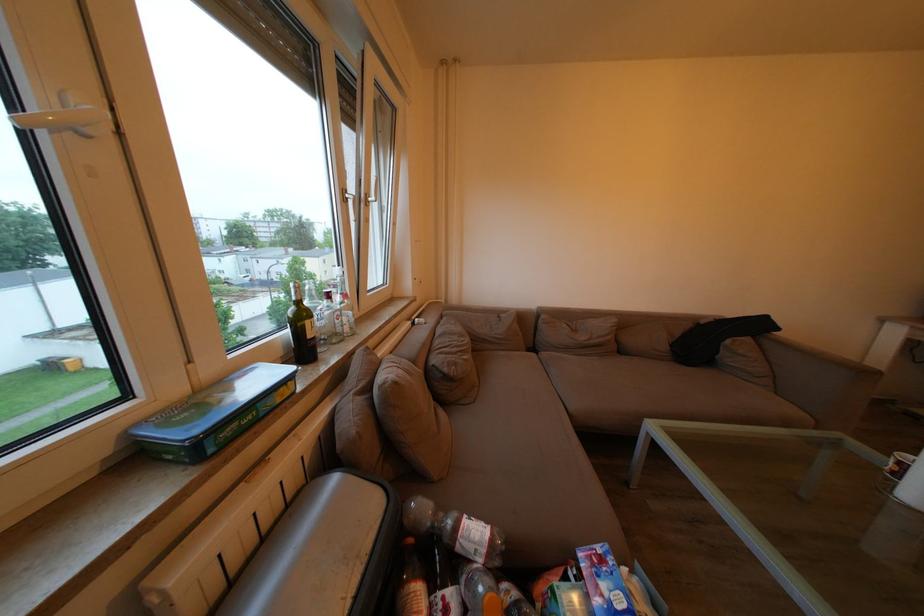
Image resolution: width=924 pixels, height=616 pixels. Find the location of `white window handle`. white window handle is located at coordinates (63, 118).